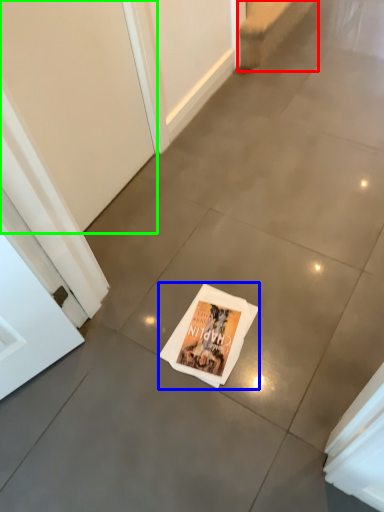
Question: Which object is positioned closest to stairwell (highlighted by a red box)? Select from magazine (highlighted by a blue box) and screen door (highlighted by a green box).

Choices:
 (A) magazine
 (B) screen door

Answer: (B)